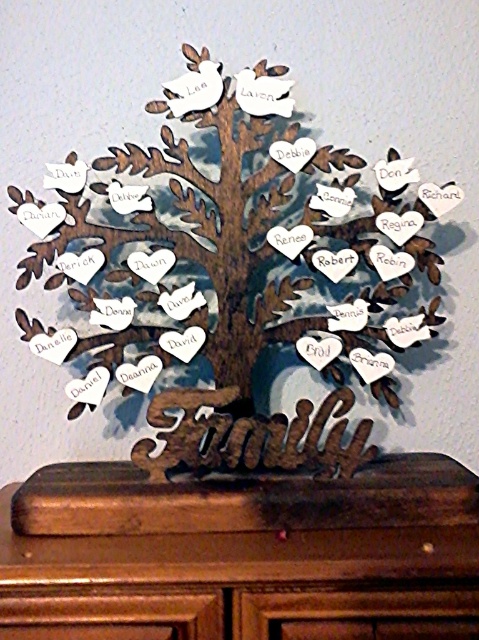
Question: Which point is closer to the camera?

Choices:
 (A) wooden family tree at center
 (B) brown wood dresser at lower center

Answer: (B)

Question: Can you confirm if wooden family tree at center is positioned above brown wood dresser at lower center?

Choices:
 (A) no
 (B) yes

Answer: (B)

Question: Which point is closer to the camera taking this photo?

Choices:
 (A) (470, 556)
 (B) (193, 333)

Answer: (A)

Question: Considering the relative positions of wooden family tree at center and brown wood dresser at lower center in the image provided, where is wooden family tree at center located with respect to brown wood dresser at lower center?

Choices:
 (A) right
 (B) left

Answer: (B)

Question: In this image, where is wooden family tree at center located relative to brown wood dresser at lower center?

Choices:
 (A) below
 (B) above

Answer: (B)

Question: Which of the following is the closest to the observer?

Choices:
 (A) (365, 188)
 (B) (198, 504)

Answer: (B)